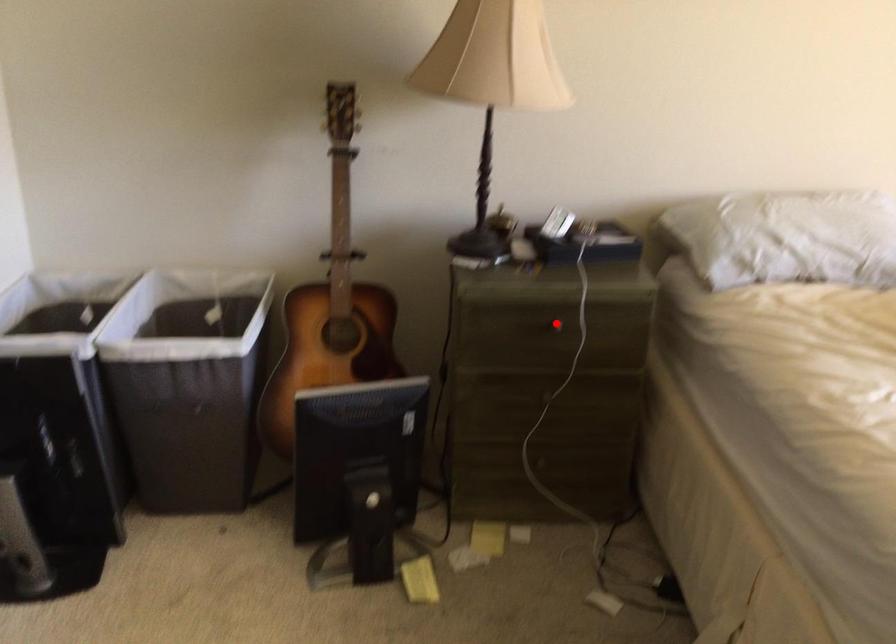
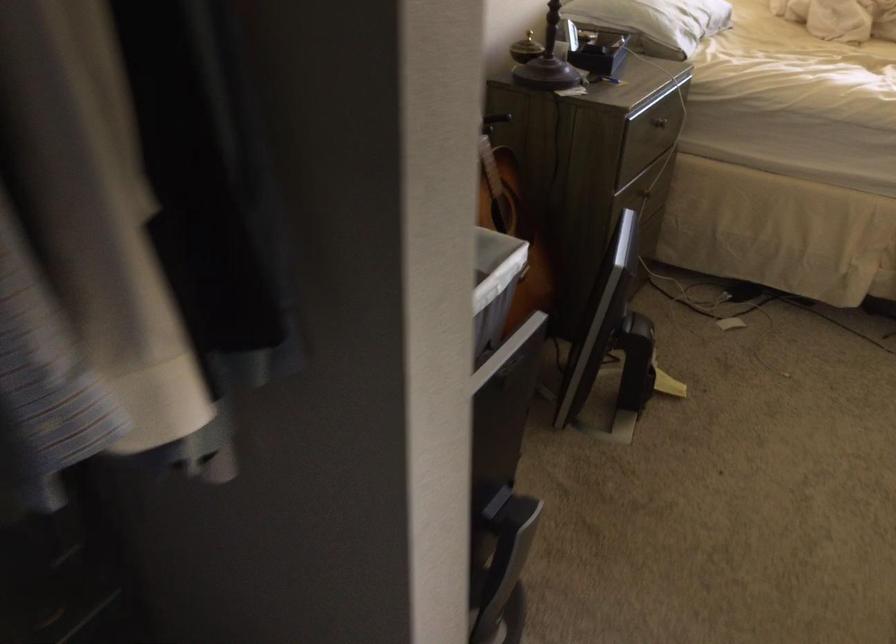
The point at the highlighted location is marked in the first image. Where is the corresponding point in the second image?

(659, 122)